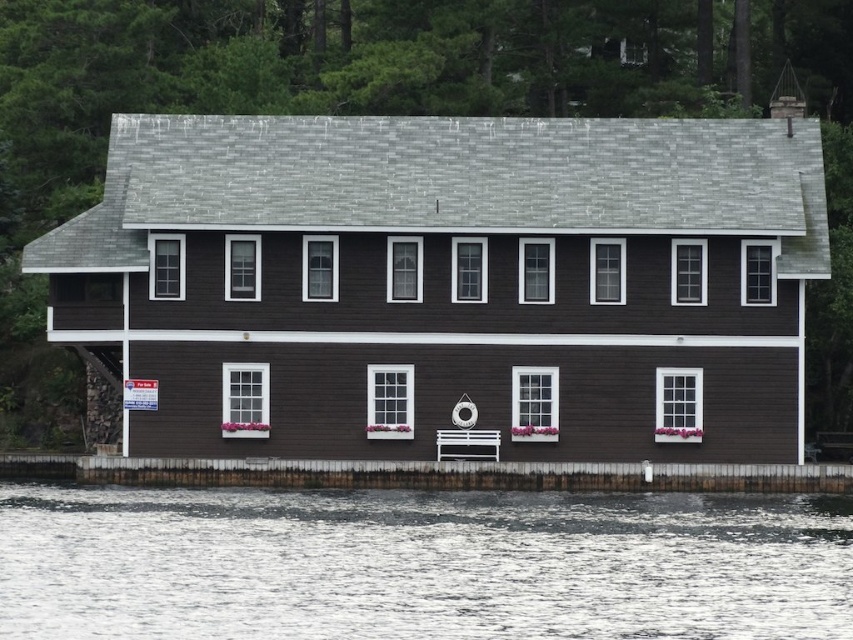
You are standing at the entrance of the two story boathouse and looking towards the water. There is a point marked at coordinates (419, 563) which is clear water at lower center. Can you see the clear water at lower center from your current position?

Yes, the point marked at coordinates (419, 563) indicates clear water at lower center, so you can see the clear water at lower center from your current position.

You are standing on the white wood dock at center and want to step onto the clear water at lower center. Is this possible?

The clear water at lower center is positioned on the left side of white wood dock at center. Since water is not solid ground, you cannot step onto it from the dock.

You are standing on the white wood dock at center and want to step onto the clear water at lower center. Is the water surface lower than the dock? Please explain.

The clear water at lower center has a lesser height compared to the white wood dock at center, so yes, the water surface is lower than the dock. This means you can step down from the dock onto the water surface.